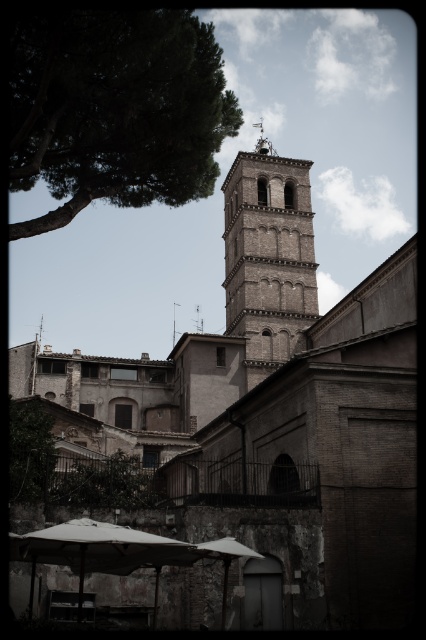
Is green leafy tree at upper left taller than brown brick bell tower at center?

Incorrect, green leafy tree at upper left's height is not larger of brown brick bell tower at center's.

Who is higher up, green leafy tree at upper left or brown brick bell tower at center?

brown brick bell tower at center is above.

Describe the element at coordinates (115, 109) in the screenshot. Image resolution: width=426 pixels, height=640 pixels. I see `green leafy tree at upper left` at that location.

Where is `green leafy tree at upper left`? green leafy tree at upper left is located at coordinates (115, 109).